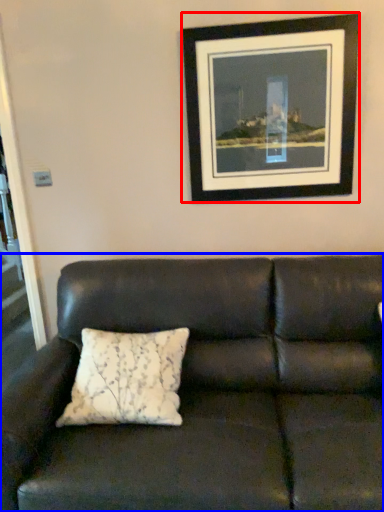
Question: Which point is closer to the camera, picture frame (highlighted by a red box) or studio couch (highlighted by a blue box)?

Choices:
 (A) picture frame
 (B) studio couch

Answer: (B)